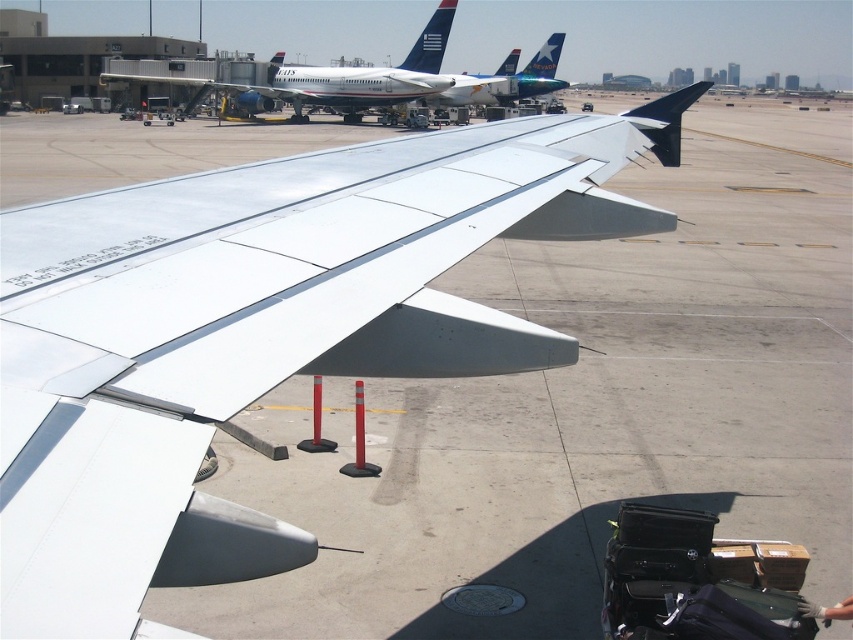
You are standing at the point labeled point (334, 77) in the image. Based on the scene description, what object are you currently standing on?

The point (334, 77) is on the white matte airplane at upper center, so you are standing on the white matte airplane at upper center.

You are a passenger sitting in the aircraft and looking out the window. You notice two points marked on the window at coordinates point (19,488) and point (538,77). Which point is closer to your eyes?

Point (19,488) is closer to the camera than point (538,77), so the point closer to your eyes is point (19,488).